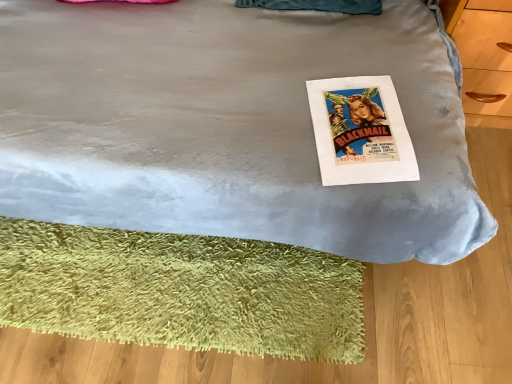
Question: Does green shaggy mat at lower left have a lesser width compared to velvet blue bed at center?

Choices:
 (A) no
 (B) yes

Answer: (B)

Question: Considering the relative sizes of green shaggy mat at lower left and velvet blue bed at center in the image provided, is green shaggy mat at lower left wider than velvet blue bed at center?

Choices:
 (A) no
 (B) yes

Answer: (A)

Question: Is green shaggy mat at lower left bigger than velvet blue bed at center?

Choices:
 (A) no
 (B) yes

Answer: (A)

Question: Does green shaggy mat at lower left have a smaller size compared to velvet blue bed at center?

Choices:
 (A) no
 (B) yes

Answer: (B)

Question: From the image's perspective, is green shaggy mat at lower left over velvet blue bed at center?

Choices:
 (A) no
 (B) yes

Answer: (A)

Question: Is green shaggy mat at lower left positioned with its back to velvet blue bed at center?

Choices:
 (A) no
 (B) yes

Answer: (B)

Question: Considering the relative sizes of white paper at center and green shaggy mat at lower left in the image provided, is white paper at center smaller than green shaggy mat at lower left?

Choices:
 (A) yes
 (B) no

Answer: (A)

Question: From the image's perspective, is white paper at center on green shaggy mat at lower left?

Choices:
 (A) no
 (B) yes

Answer: (B)

Question: Is the depth of white paper at center greater than that of green shaggy mat at lower left?

Choices:
 (A) no
 (B) yes

Answer: (A)

Question: Does white paper at center have a lesser width compared to green shaggy mat at lower left?

Choices:
 (A) no
 (B) yes

Answer: (B)

Question: Is there a large distance between white paper at center and green shaggy mat at lower left?

Choices:
 (A) no
 (B) yes

Answer: (A)

Question: Does white paper at center turn towards green shaggy mat at lower left?

Choices:
 (A) no
 (B) yes

Answer: (A)

Question: Is velvet blue bed at center thinner than white paper at center?

Choices:
 (A) no
 (B) yes

Answer: (A)